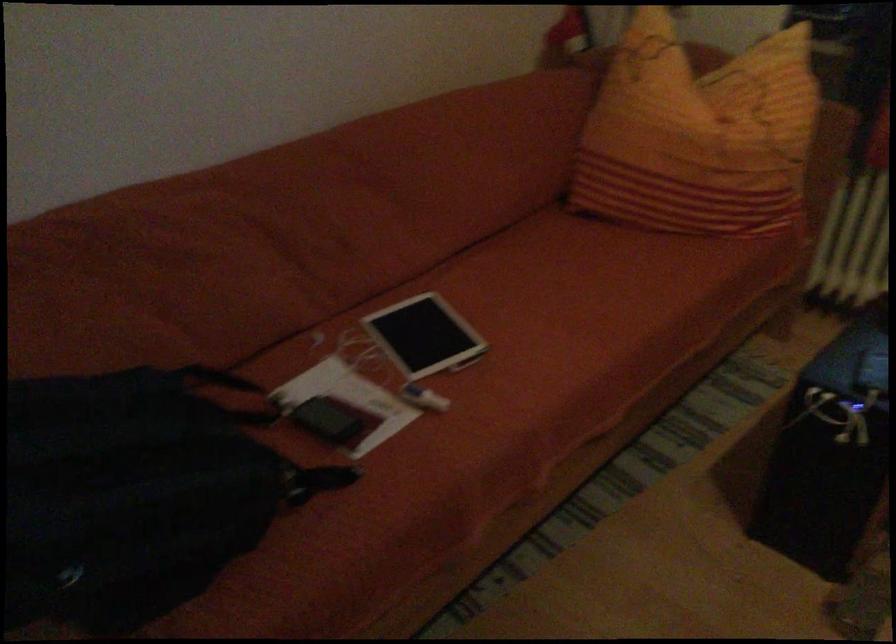
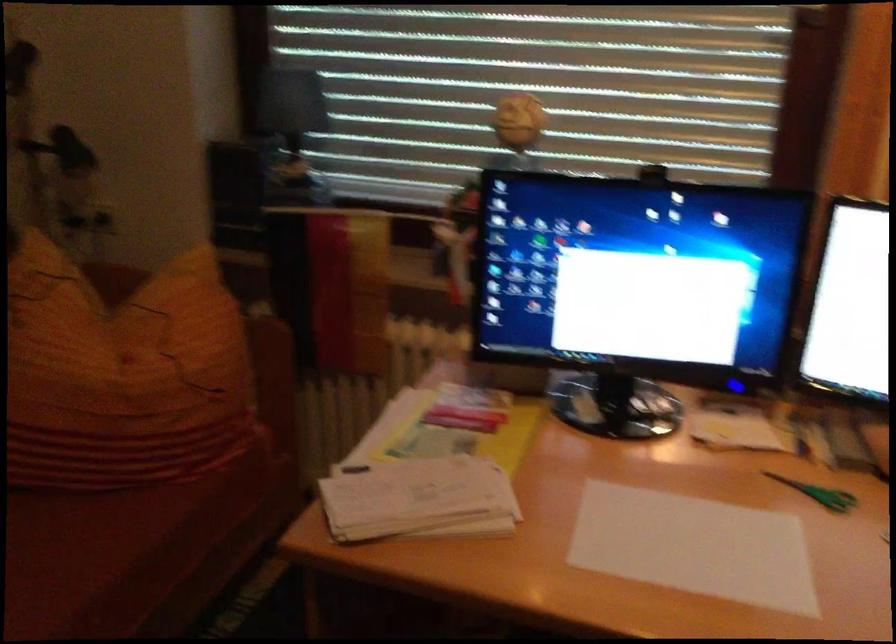
Find the pixel in the second image that matches the point at 719,129 in the first image.

(122, 374)